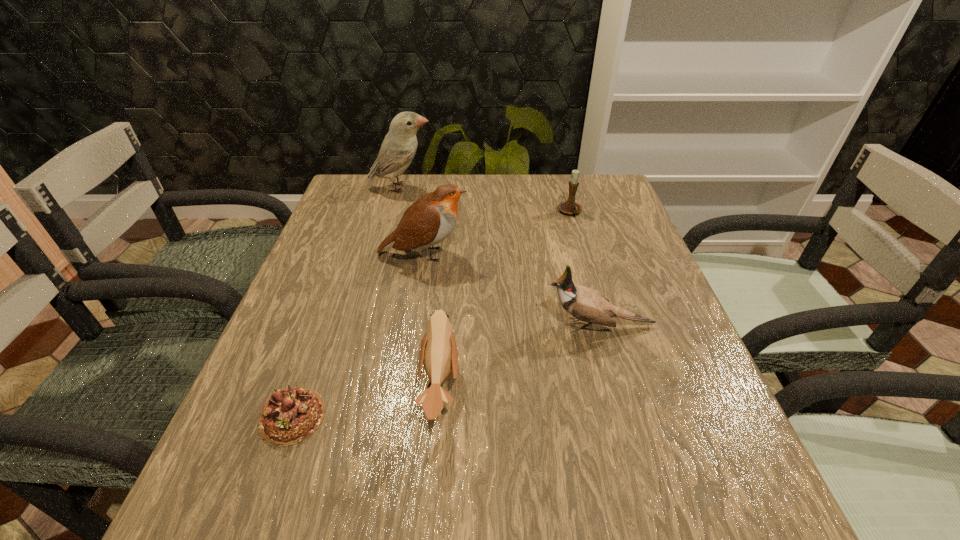
Where is `vacant space that is in between the tallest bird and the candle holder`? vacant space that is in between the tallest bird and the candle holder is located at coordinates (486, 200).

The image size is (960, 540). Identify the location of unoccupied area between the rightmost bird and the third nearest bird. (511, 290).

Locate an element on the screen. The width and height of the screenshot is (960, 540). vacant area that lies between the shortest bird and the fourth shortest object is located at coordinates pyautogui.click(x=519, y=357).

Where is `vacant space in between the shortest bird and the farthest bird`? This screenshot has height=540, width=960. vacant space in between the shortest bird and the farthest bird is located at coordinates (420, 288).

Image resolution: width=960 pixels, height=540 pixels. I want to click on free space between the shortest bird and the fifth nearest object, so click(506, 300).

This screenshot has width=960, height=540. Find the location of `vacant area that lies between the fourth shortest object and the third nearest bird`. vacant area that lies between the fourth shortest object and the third nearest bird is located at coordinates (511, 290).

Image resolution: width=960 pixels, height=540 pixels. Find the location of `vacant space that's between the farthest bird and the chocolate cake`. vacant space that's between the farthest bird and the chocolate cake is located at coordinates (347, 302).

Identify which object is the second closest to the shortest bird. Please provide its 2D coordinates. Your answer should be formatted as a tuple, i.e. [(x, y)], where the tuple contains the x and y coordinates of a point satisfying the conditions above.

[(585, 304)]

Locate which object ranks third in proximity to the third farthest object. Please provide its 2D coordinates. Your answer should be formatted as a tuple, i.e. [(x, y)], where the tuple contains the x and y coordinates of a point satisfying the conditions above.

[(398, 149)]

Locate an element on the screen. The width and height of the screenshot is (960, 540). bird that is the closest one to the fifth nearest object is located at coordinates (431, 219).